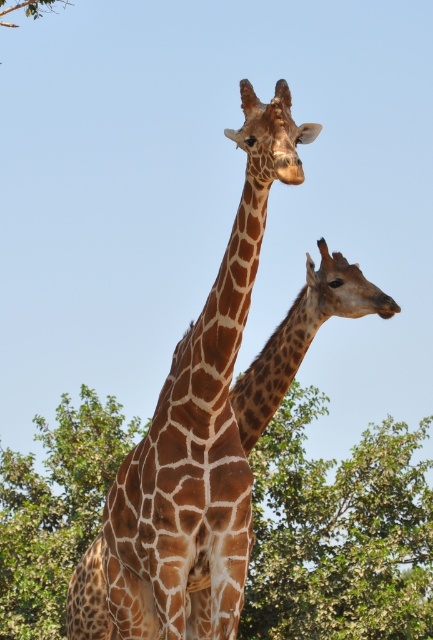
Question: Which point is farther from the camera taking this photo?

Choices:
 (A) (255, 266)
 (B) (12, 518)

Answer: (B)

Question: Can you confirm if green leafy tree at center is positioned above brown spotted giraffe at center?

Choices:
 (A) no
 (B) yes

Answer: (A)

Question: Can you confirm if green leafy tree at center is thinner than brown spotted giraffe at center?

Choices:
 (A) no
 (B) yes

Answer: (A)

Question: Among these objects, which one is nearest to the camera?

Choices:
 (A) brown spotted giraffe at center
 (B) green leafy tree at center

Answer: (A)

Question: Can you confirm if green leafy tree at center is positioned to the right of brown spotted giraffe at center?

Choices:
 (A) no
 (B) yes

Answer: (A)